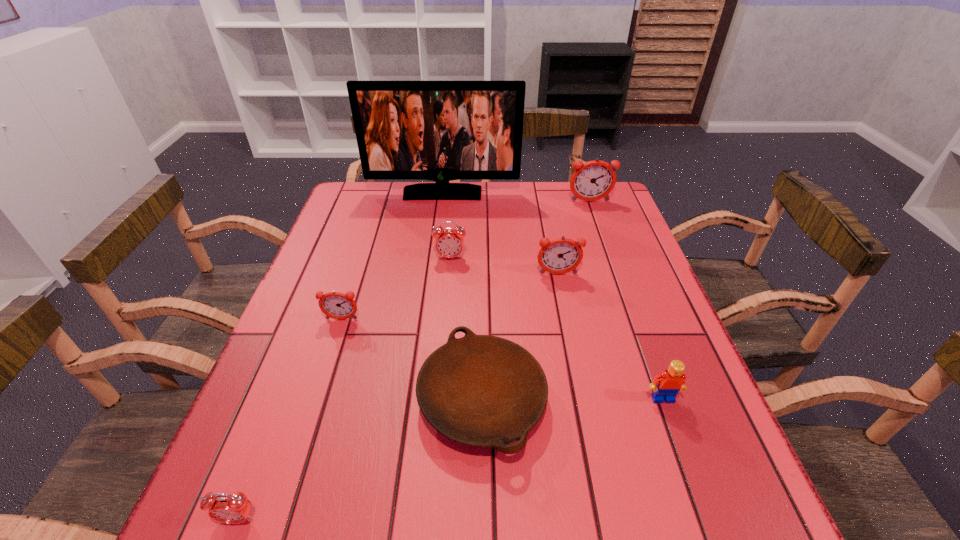
Locate an element on the screen. Image resolution: width=960 pixels, height=540 pixels. free space at the far edge of the desktop is located at coordinates (569, 210).

Locate an element on the screen. free space at the left edge of the desktop is located at coordinates (313, 467).

In the image, there is a desktop. Where is `free space at the right edge`? The height and width of the screenshot is (540, 960). free space at the right edge is located at coordinates (704, 491).

Locate an element on the screen. The image size is (960, 540). free space at the near right corner is located at coordinates (735, 523).

The width and height of the screenshot is (960, 540). In order to click on vacant area between the red Lego and the third alarm clock from left to right in this screenshot , I will do `click(557, 328)`.

Where is `free space between the third alarm clock from right to left and the second nearest alarm clock`? free space between the third alarm clock from right to left and the second nearest alarm clock is located at coordinates (396, 289).

Identify the location of free area in between the leftmost reddish-pink alarm clock and the fourth farthest object. Image resolution: width=960 pixels, height=540 pixels. (450, 297).

The image size is (960, 540). What are the coordinates of `free space between the red Lego and the third farthest object` in the screenshot? It's located at (557, 328).

Find the location of a particular element. The image size is (960, 540). vacant area that lies between the fifth nearest object and the smaller red alarm clock is located at coordinates (398, 396).

I want to click on empty space between the rightmost reddish-pink alarm clock and the third farthest object, so click(x=520, y=230).